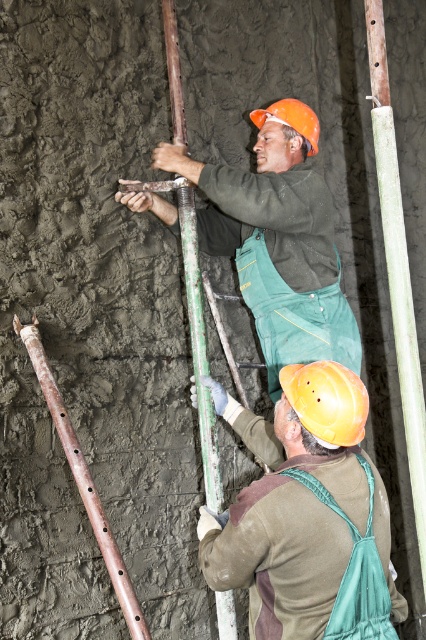
Between matte yellow hard hat at center and smooth green pole at right, which one is positioned higher?

Positioned higher is smooth green pole at right.

Which is below, matte yellow hard hat at center or smooth green pole at right?

Positioned lower is matte yellow hard hat at center.

Image resolution: width=426 pixels, height=640 pixels. Identify the location of matte yellow hard hat at center. (307, 515).

Identify the location of matte yellow hard hat at center. (307, 515).

Which is above, matte yellow hard hat at center or rusty metal pole at center?

rusty metal pole at center

Is matte yellow hard hat at center below rusty metal pole at center?

Indeed, matte yellow hard hat at center is positioned under rusty metal pole at center.

Where is `matte yellow hard hat at center`? The image size is (426, 640). matte yellow hard hat at center is located at coordinates (307, 515).

Locate an element on the screen. matte yellow hard hat at center is located at coordinates (307, 515).

Which is more to the right, smooth green pole at right or rusty metal pole at center?

smooth green pole at right

From the picture: Between smooth green pole at right and rusty metal pole at center, which one has less height?

rusty metal pole at center

The height and width of the screenshot is (640, 426). What do you see at coordinates (397, 268) in the screenshot?
I see `smooth green pole at right` at bounding box center [397, 268].

In order to click on smooth green pole at right in this screenshot , I will do `click(397, 268)`.